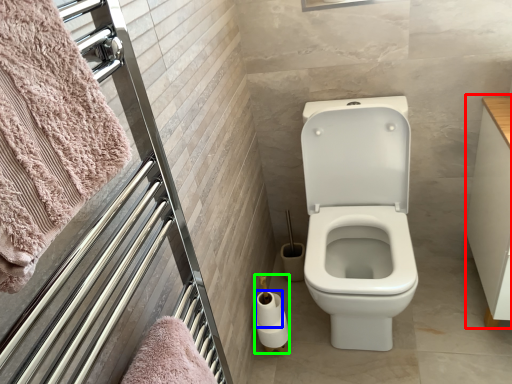
Question: Which object is the farthest from drawer (highlighted by a red box)? Choose among these: toilet paper (highlighted by a blue box) or toilet paper (highlighted by a green box).

Choices:
 (A) toilet paper
 (B) toilet paper

Answer: (A)